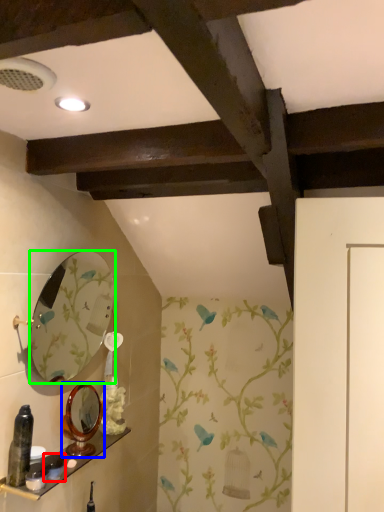
Question: Considering the real-world distances, which object is farthest from toiletry (highlighted by a red box)? mirror (highlighted by a blue box) or mirror (highlighted by a green box)?

Choices:
 (A) mirror
 (B) mirror

Answer: (B)